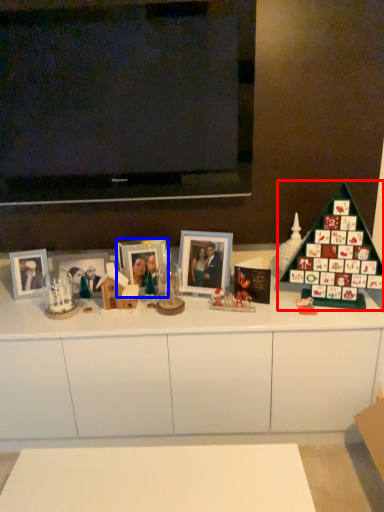
Question: Which point is closer to the camera, christmas tree (highlighted by a red box) or picture frame (highlighted by a blue box)?

Choices:
 (A) christmas tree
 (B) picture frame

Answer: (A)